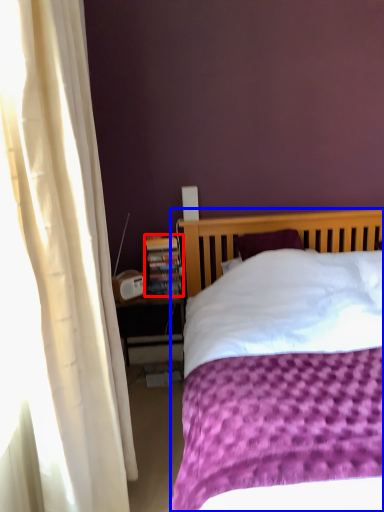
Question: Among these objects, which one is nearest to the camera, paperback book (highlighted by a red box) or bed (highlighted by a blue box)?

Choices:
 (A) paperback book
 (B) bed

Answer: (B)